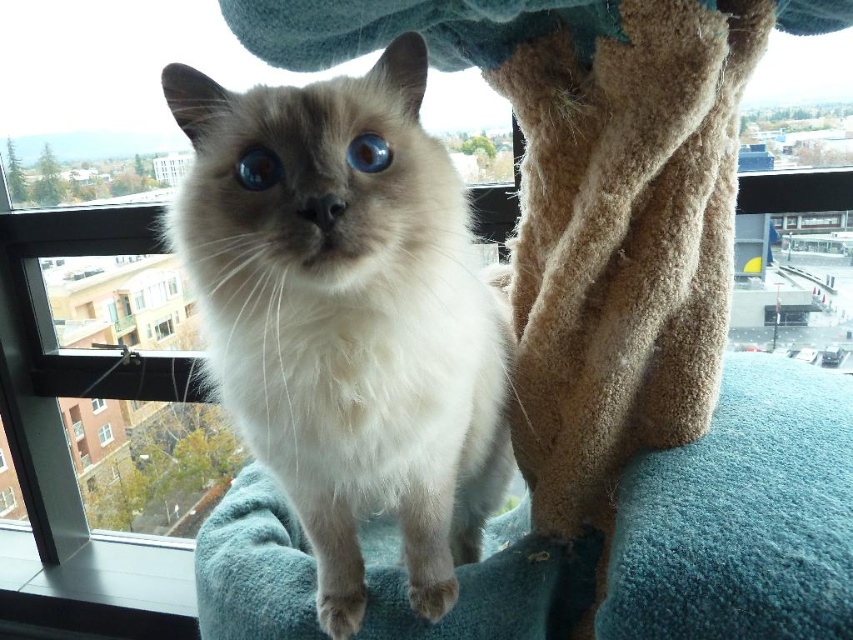
Can you confirm if clear glass window at center is taller than transparent glass window at lower left?

Yes.

In order to click on clear glass window at center in this screenshot , I will do `click(123, 305)`.

The width and height of the screenshot is (853, 640). In order to click on clear glass window at center in this screenshot , I will do `click(123, 305)`.

Can you confirm if transparent glass window at center is positioned below transparent plastic window at lower left?

No, transparent glass window at center is not below transparent plastic window at lower left.

Is transparent glass window at center to the right of transparent plastic window at lower left from the viewer's perspective?

Correct, you'll find transparent glass window at center to the right of transparent plastic window at lower left.

This screenshot has height=640, width=853. What do you see at coordinates (138, 300) in the screenshot? I see `transparent glass window at center` at bounding box center [138, 300].

Locate an element on the screen. The image size is (853, 640). transparent glass window at center is located at coordinates [x=138, y=300].

Which is below, transparent glass window at lower left or transparent plastic window at lower left?

transparent plastic window at lower left

From the picture: Does transparent glass window at lower left have a lesser height compared to transparent plastic window at lower left?

Yes, transparent glass window at lower left is shorter than transparent plastic window at lower left.

Between point (91, 406) and point (1, 460), which one is positioned behind?

Positioned behind is point (1, 460).

Where is `transparent glass window at lower left`? The width and height of the screenshot is (853, 640). transparent glass window at lower left is located at coordinates (97, 404).